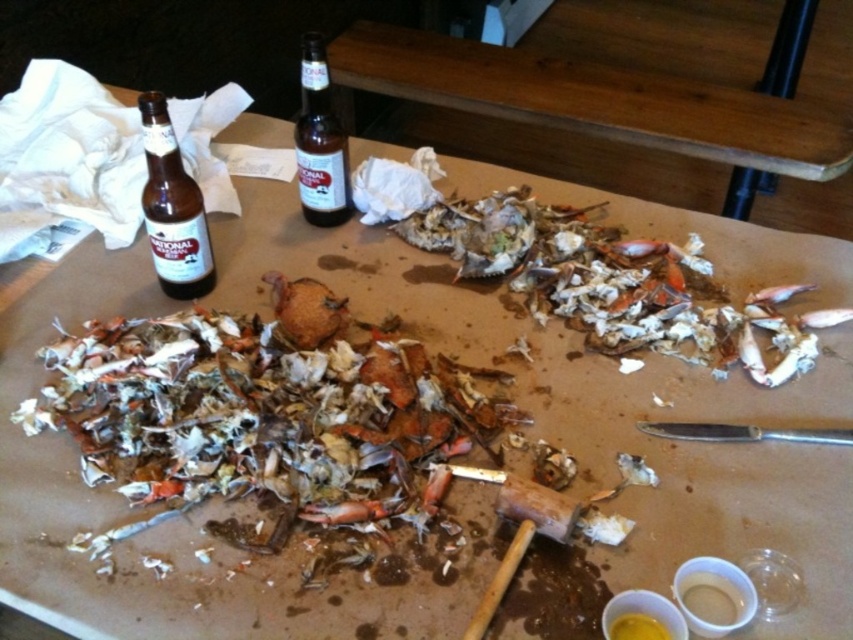
Is brown crumbly crab shell at center to the left of brown glass bottle at left from the viewer's perspective?

Incorrect, brown crumbly crab shell at center is not on the left side of brown glass bottle at left.

Describe the element at coordinates (264, 412) in the screenshot. I see `brown crumbly crab shell at center` at that location.

Locate an element on the screen. The image size is (853, 640). brown crumbly crab shell at center is located at coordinates click(264, 412).

From the picture: Between brown crumbly crab shell at center and brown纸质蟹壳 at center, which one has more height?

With more height is brown crumbly crab shell at center.

Is brown crumbly crab shell at center bigger than brown纸质蟹壳 at center?

Correct, brown crumbly crab shell at center is larger in size than brown纸质蟹壳 at center.

Between point (183, 412) and point (540, 236), which one is positioned behind?

The point (540, 236) is behind.

Find the location of a particular element. Image resolution: width=853 pixels, height=640 pixels. brown crumbly crab shell at center is located at coordinates (264, 412).

Can you confirm if brown crumbly crab shell at center is taller than brown glass bottle at center?

Yes, brown crumbly crab shell at center is taller than brown glass bottle at center.

Is brown crumbly crab shell at center below brown glass bottle at center?

Yes.

Image resolution: width=853 pixels, height=640 pixels. What do you see at coordinates (264, 412) in the screenshot?
I see `brown crumbly crab shell at center` at bounding box center [264, 412].

I want to click on brown crumbly crab shell at center, so click(264, 412).